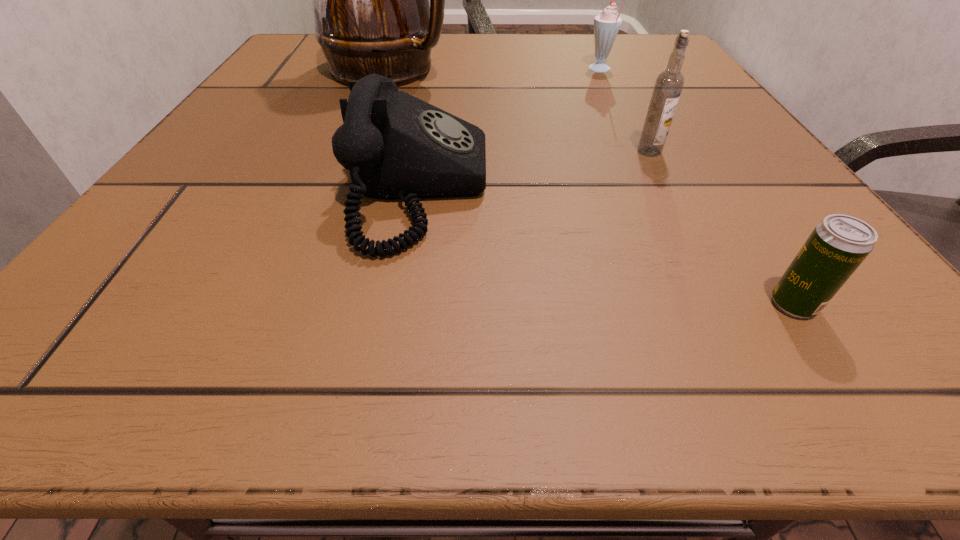
This screenshot has height=540, width=960. I want to click on the tallest object, so [x=370, y=0].

The image size is (960, 540). I want to click on vodka, so click(x=669, y=84).

Where is `milkshake`? This screenshot has width=960, height=540. milkshake is located at coordinates (606, 25).

Find the location of a particular element. The height and width of the screenshot is (540, 960). telephone is located at coordinates click(x=396, y=147).

Locate an element on the screen. the nearest object is located at coordinates (837, 246).

Where is `the rightmost object`? This screenshot has width=960, height=540. the rightmost object is located at coordinates (837, 246).

This screenshot has height=540, width=960. What are the coordinates of `blank area located from the spout of the tallest object` in the screenshot? It's located at (653, 69).

Locate an element on the screen. The width and height of the screenshot is (960, 540). blank space located 0.180m on the label of the second tallest object is located at coordinates (693, 237).

Locate an element on the screen. The width and height of the screenshot is (960, 540). vacant area situated 0.370m on the straw side of the milkshake is located at coordinates (402, 70).

You are a GUI agent. You are given a task and a screenshot of the screen. Output one action in this format:
    pyautogui.click(x=<x>, y=<y>)
    Task: Click on the vacant region located 0.170m on the straw side of the milkshake
    Image resolution: width=960 pixels, height=540 pixels.
    Given the screenshot: What is the action you would take?
    pyautogui.click(x=502, y=70)